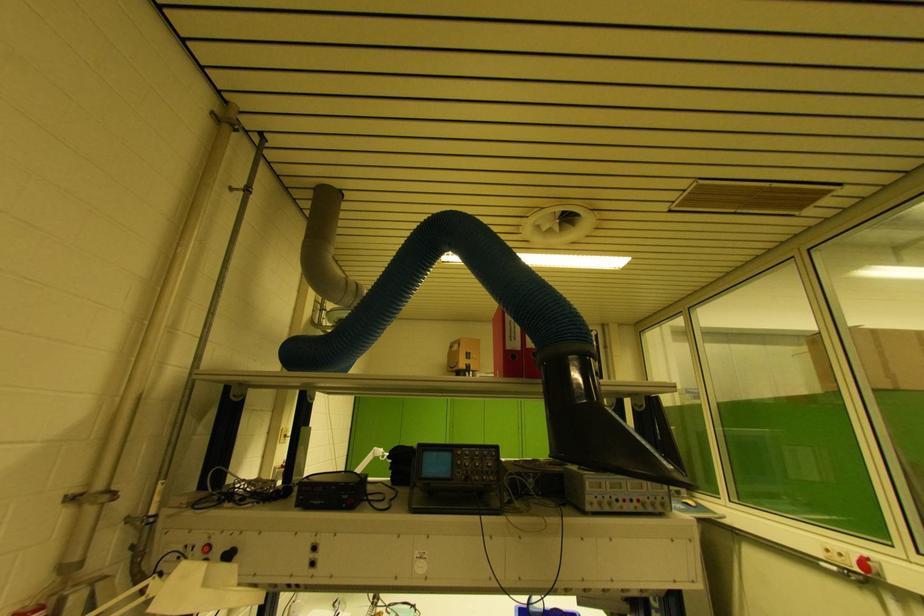
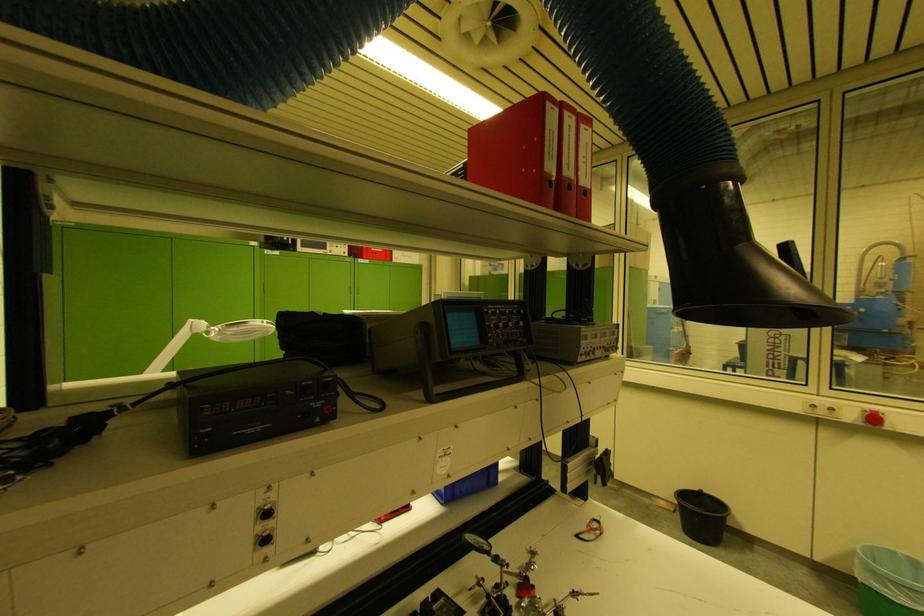
How did the camera likely rotate?

The camera's rotation is toward right-down.